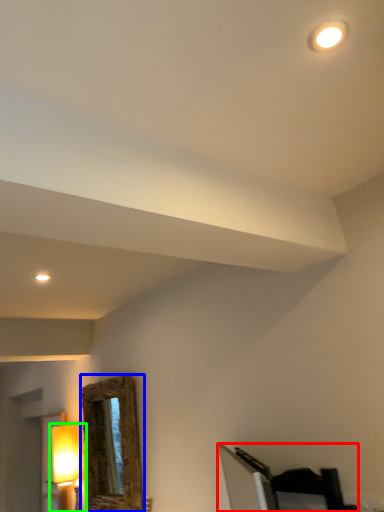
Question: Which object is positioned farthest from furniture (highlighted by a red box)? Select from mirror (highlighted by a blue box) and lamp (highlighted by a green box).

Choices:
 (A) mirror
 (B) lamp

Answer: (B)